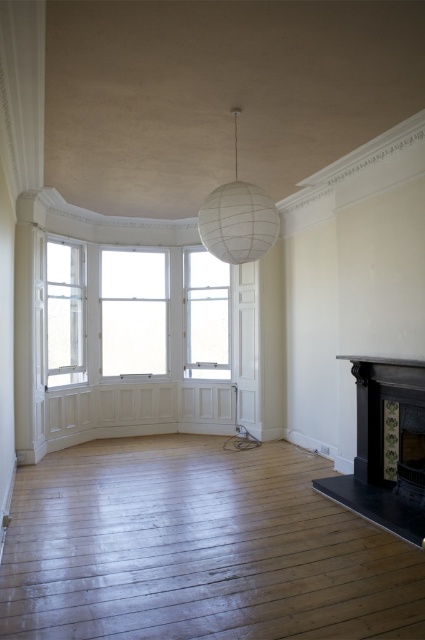
Question: Which is farther from the clear glass window at center?

Choices:
 (A) black stone fireplace at lower right
 (B) clear glass window at left

Answer: (A)

Question: Which object is farther from the camera taking this photo?

Choices:
 (A) white glass window at center
 (B) black stone fireplace at lower right
 (C) clear glass window at center
 (D) clear glass window at left

Answer: (C)

Question: Is black stone fireplace at lower right above clear glass window at center?

Choices:
 (A) yes
 (B) no

Answer: (B)

Question: Is white glass window at center smaller than clear glass window at center?

Choices:
 (A) no
 (B) yes

Answer: (A)

Question: Is black stone fireplace at lower right positioned in front of clear glass window at center?

Choices:
 (A) no
 (B) yes

Answer: (B)

Question: Which object is closer to the camera taking this photo?

Choices:
 (A) clear glass window at left
 (B) clear glass window at center
 (C) white glass window at center

Answer: (A)